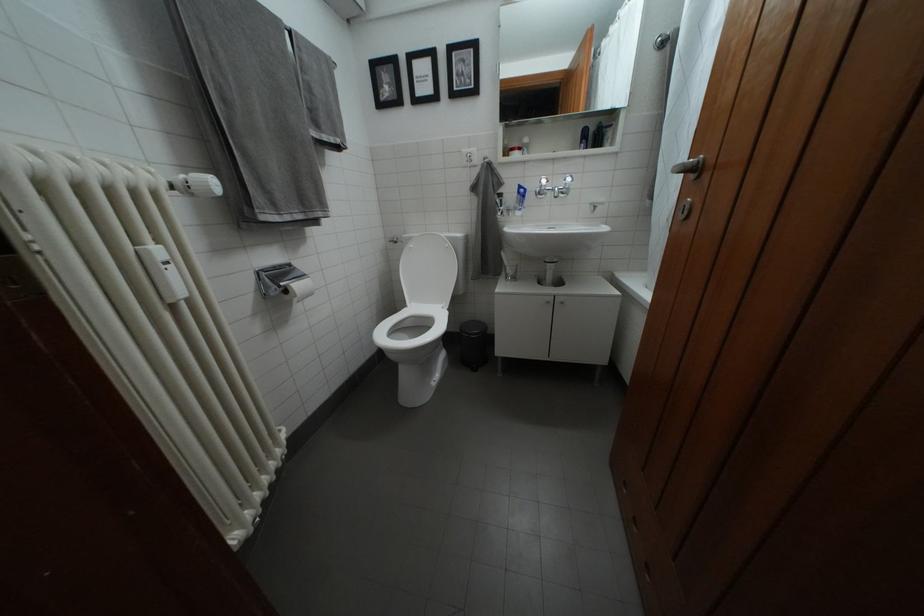
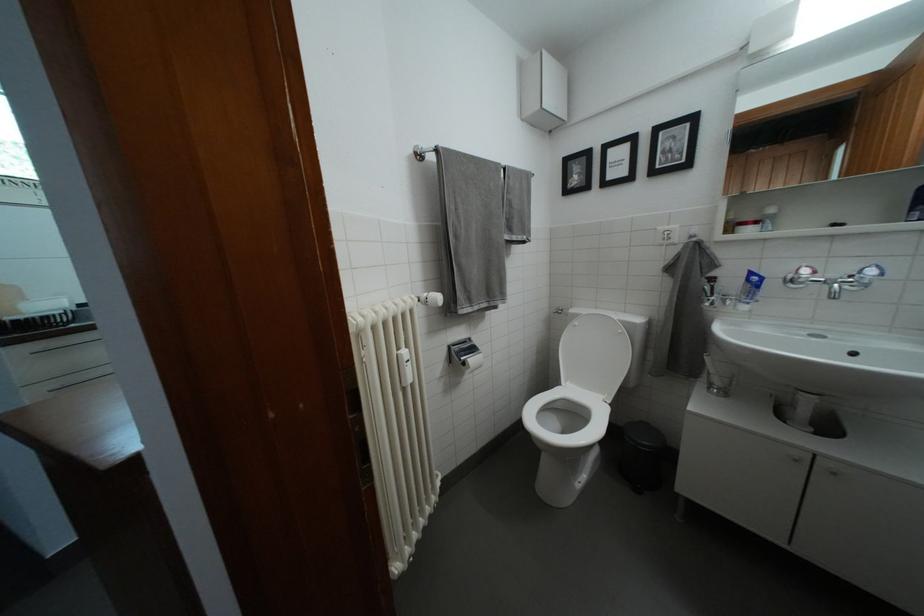
Find the pixel in the second image that matches point 419,245 in the first image.

(585, 321)